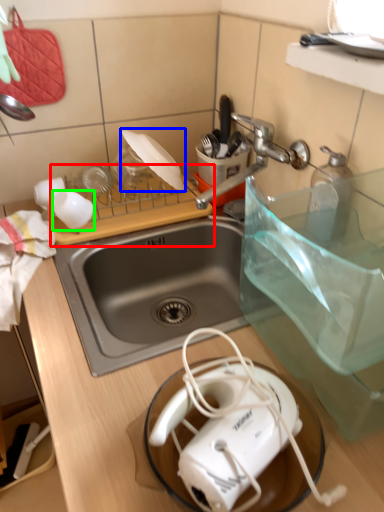
Question: Considering the real-world distances, which object is farthest from cutting board (highlighted by a red box)? appliance (highlighted by a blue box) or coffee cup (highlighted by a green box)?

Choices:
 (A) appliance
 (B) coffee cup

Answer: (A)